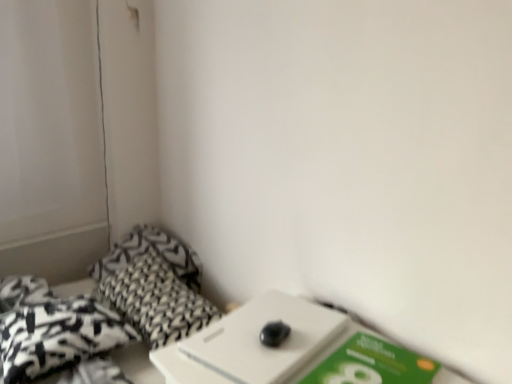
Question: Is black printed fabric at lower left at the left side of green matte paperback book at lower right?

Choices:
 (A) yes
 (B) no

Answer: (A)

Question: Does black printed fabric at lower left turn towards green matte paperback book at lower right?

Choices:
 (A) no
 (B) yes

Answer: (B)

Question: Does black printed fabric at lower left have a greater height compared to green matte paperback book at lower right?

Choices:
 (A) no
 (B) yes

Answer: (B)

Question: Would you say black printed fabric at lower left is a long distance from green matte paperback book at lower right?

Choices:
 (A) yes
 (B) no

Answer: (B)

Question: Does black printed fabric at lower left lie behind green matte paperback book at lower right?

Choices:
 (A) yes
 (B) no

Answer: (A)

Question: From the image's perspective, is black printed fabric at lower left above green matte paperback book at lower right?

Choices:
 (A) yes
 (B) no

Answer: (B)

Question: Is green matte paperback book at lower right looking in the opposite direction of black and white patterned throw pillow at lower left?

Choices:
 (A) no
 (B) yes

Answer: (A)

Question: From a real-world perspective, is green matte paperback book at lower right on black and white patterned throw pillow at lower left?

Choices:
 (A) no
 (B) yes

Answer: (B)

Question: Does green matte paperback book at lower right have a greater height compared to black and white patterned throw pillow at lower left?

Choices:
 (A) yes
 (B) no

Answer: (B)

Question: From the image's perspective, does green matte paperback book at lower right appear lower than black and white patterned throw pillow at lower left?

Choices:
 (A) yes
 (B) no

Answer: (B)

Question: Is green matte paperback book at lower right placed right next to black and white patterned throw pillow at lower left?

Choices:
 (A) no
 (B) yes

Answer: (A)

Question: Is green matte paperback book at lower right to the left of black and white patterned throw pillow at lower left from the viewer's perspective?

Choices:
 (A) yes
 (B) no

Answer: (B)

Question: Is black textured pillow at lower left, the 1th pillow from the front, located within black printed fabric at lower left?

Choices:
 (A) no
 (B) yes

Answer: (B)